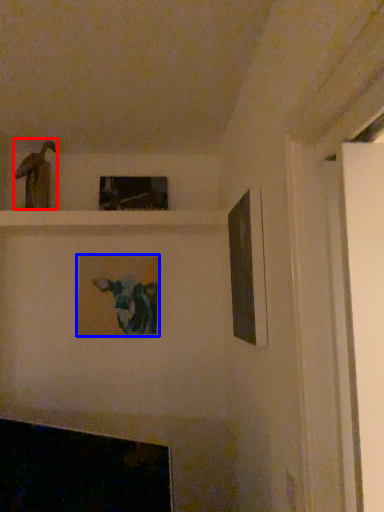
Question: Which object is closer to the camera taking this photo, art (highlighted by a red box) or picture frame (highlighted by a blue box)?

Choices:
 (A) art
 (B) picture frame

Answer: (A)